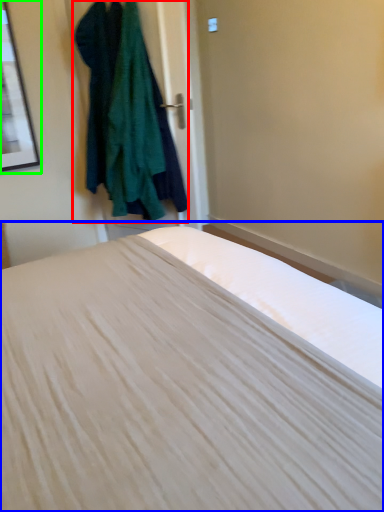
Question: Which is nearer to the clothing (highlighted by a red box)? bed (highlighted by a blue box) or picture frame (highlighted by a green box).

Choices:
 (A) bed
 (B) picture frame

Answer: (B)